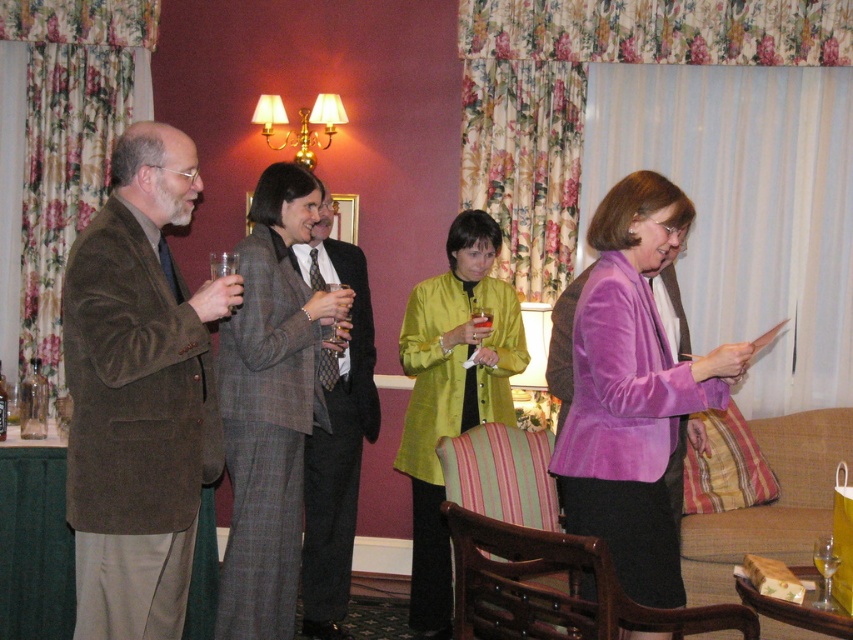
Question: Considering the real-world distances, which object is closest to the purple velvet jacket at center?

Choices:
 (A) matte green jacket at center
 (B) plaid wool suit at center
 (C) transparent plastic wine glass at center

Answer: (B)

Question: Which of the following is the closest to the observer?

Choices:
 (A) transparent plastic wine glass at center
 (B) purple velvet jacket at center

Answer: (B)

Question: Considering the relative positions of brown velvety blazer at left and plaid wool suit at center in the image provided, where is brown velvety blazer at left located with respect to plaid wool suit at center?

Choices:
 (A) below
 (B) above

Answer: (B)

Question: In this image, where is plaid wool suit at center located relative to transparent plastic wine glass at center?

Choices:
 (A) below
 (B) above

Answer: (A)

Question: Can you confirm if purple velvet jacket at center is wider than gray wool suit at center?

Choices:
 (A) no
 (B) yes

Answer: (B)

Question: Which is nearer to the plaid wool suit at center?

Choices:
 (A) matte green jacket at center
 (B) purple velvet jacket at center
 (C) transparent plastic wine glass at center
 (D) brown velvety blazer at left

Answer: (D)